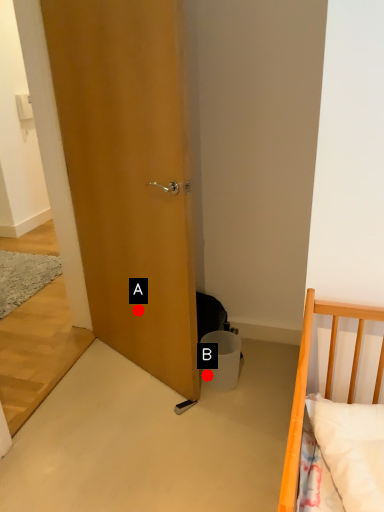
Question: Two points are circled on the image, labeled by A and B beside each circle. Which point is further to the camera?

Choices:
 (A) A is further
 (B) B is further

Answer: (A)